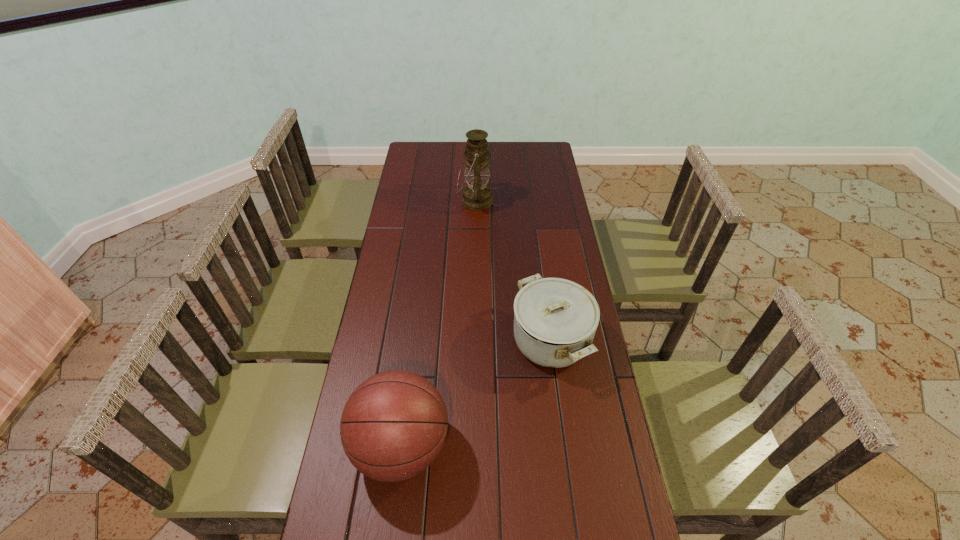
Find the location of `the farthest object`. the farthest object is located at coordinates (477, 195).

Locate an element on the screen. The height and width of the screenshot is (540, 960). oil lamp is located at coordinates (477, 195).

Image resolution: width=960 pixels, height=540 pixels. I want to click on the nearest object, so click(393, 426).

Locate an element on the screen. The image size is (960, 540). basketball is located at coordinates (393, 426).

Identify the location of the shortest object. (555, 320).

The height and width of the screenshot is (540, 960). Find the location of `the rightmost object`. the rightmost object is located at coordinates (555, 320).

Identify the location of free location located 0.110m on the right of the farthest object. This screenshot has height=540, width=960. (517, 200).

I want to click on vacant space situated on the right of the basketball, so click(599, 447).

Where is `vacant region located 0.230m on the left of the saucepan`? vacant region located 0.230m on the left of the saucepan is located at coordinates (441, 340).

This screenshot has width=960, height=540. I want to click on object that is at the left edge, so click(x=393, y=426).